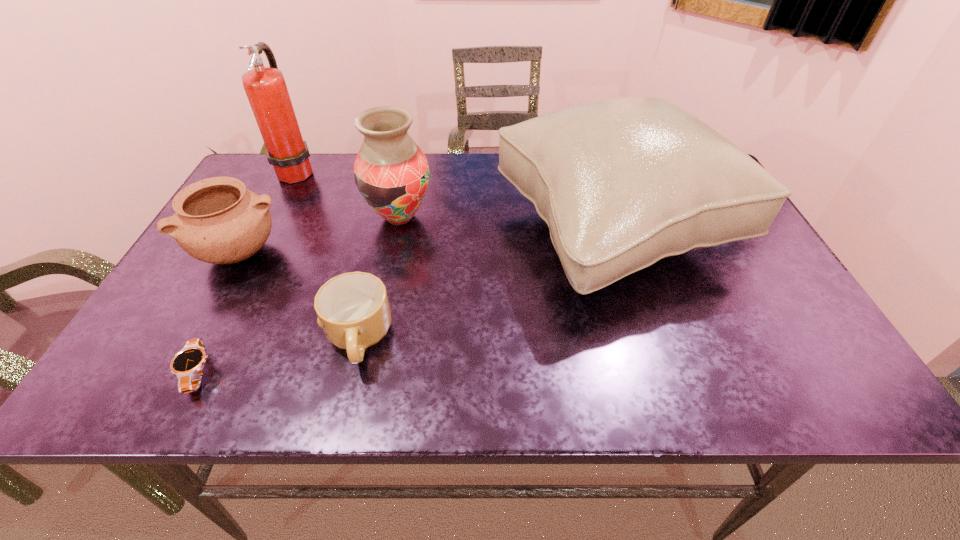
What are the coordinates of `object located in the far left corner section of the desktop` in the screenshot? It's located at (265, 87).

Locate an element on the screen. The height and width of the screenshot is (540, 960). object present at the near left corner is located at coordinates (187, 364).

The height and width of the screenshot is (540, 960). I want to click on object that is at the far right corner, so click(624, 182).

At what (x,y) coordinates should I click in order to perform the action: click on blank space at the far edge of the desktop. Please return your answer as a coordinate pair (x, y). The height and width of the screenshot is (540, 960). Looking at the image, I should click on (466, 182).

I want to click on vacant space at the near edge of the desktop, so click(x=750, y=381).

In the image, there is a desktop. Identify the location of vacant space at the right edge. (720, 300).

Where is `vacant space at the far left corner of the desktop`? The width and height of the screenshot is (960, 540). vacant space at the far left corner of the desktop is located at coordinates (283, 198).

At what (x,y) coordinates should I click in order to perform the action: click on vacant area that lies between the vase and the fire extinguisher. Please return your answer as a coordinate pair (x, y). The image size is (960, 540). Looking at the image, I should click on (348, 194).

Identify the location of free spot between the vase and the cushion. (507, 223).

Locate an element on the screen. Image resolution: width=960 pixels, height=540 pixels. free area in between the second shortest object and the tallest object is located at coordinates [x=328, y=255].